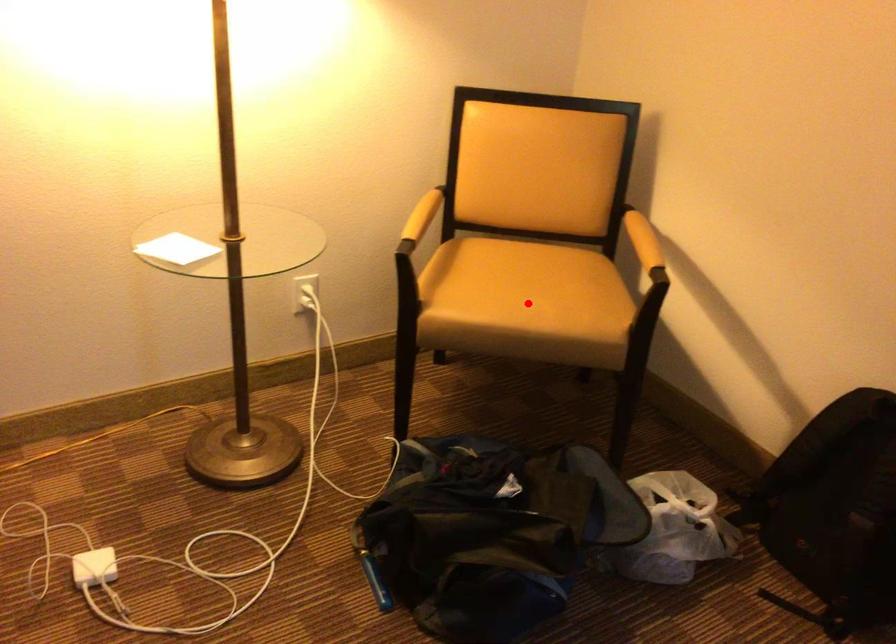
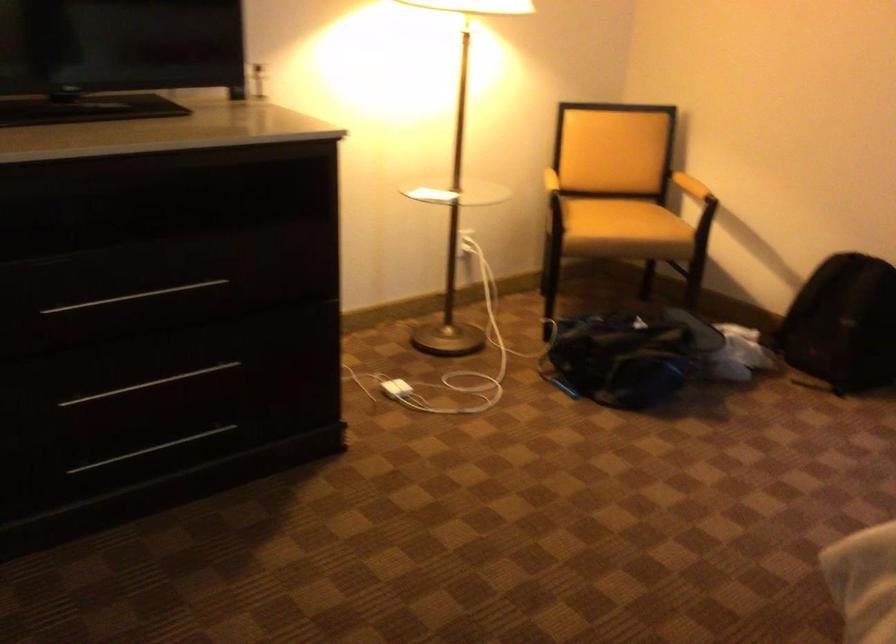
Locate, in the second image, the point that corresponds to the highlighted location in the first image.

(623, 220)